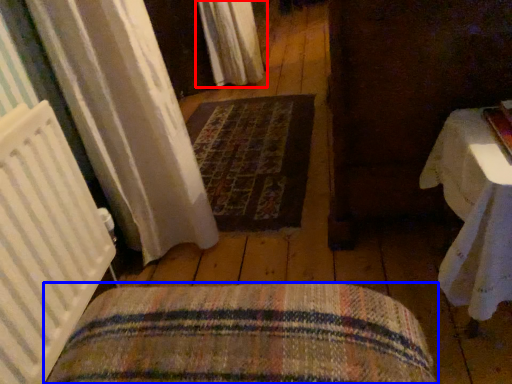
Question: Which object appears farthest to the camera in this image, curtain (highlighted by a red box) or furniture (highlighted by a blue box)?

Choices:
 (A) curtain
 (B) furniture

Answer: (A)